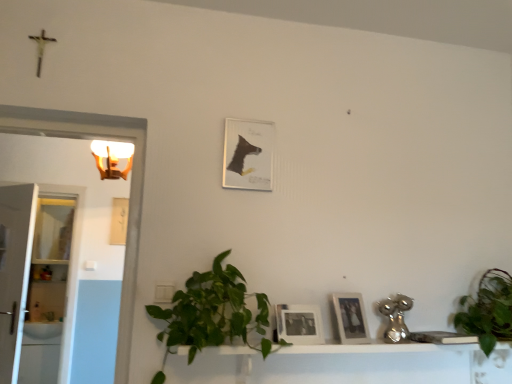
Question: In terms of height, does white glossy glass door at left, placed as the 1th glass door when sorted from front to back, look taller or shorter compared to white glossy light fixture at upper left?

Choices:
 (A) short
 (B) tall

Answer: (B)

Question: Looking at the image, does white glossy glass door at left, which is the second glass door from back to front, seem bigger or smaller compared to white glossy light fixture at upper left?

Choices:
 (A) big
 (B) small

Answer: (A)

Question: Which object is positioned closest to the green leafy plant at lower center, which is counted as the 2th houseplant, starting from the right?

Choices:
 (A) matte black photo frame at center, placed as the first picture frame when sorted from bottom to top
 (B) white glossy cabinet at left, positioned as the first glass door in back-to-front order
 (C) white glossy sink at left
 (D) white glossy glass door at left, which is the second glass door from back to front
 (E) white glossy light fixture at upper left

Answer: (A)

Question: Considering the real-world distances, which object is farthest from the matte paper picture frame at center, the fourth picture frame when ordered from bottom to top?

Choices:
 (A) white glossy light fixture at upper left
 (B) matte black photo frame at center, which is counted as the second picture frame, starting from the right
 (C) white glossy vanity at lower center
 (D) white glossy sink at left
 (E) green leafy plant at lower center, which is counted as the 1th houseplant, starting from the left

Answer: (D)